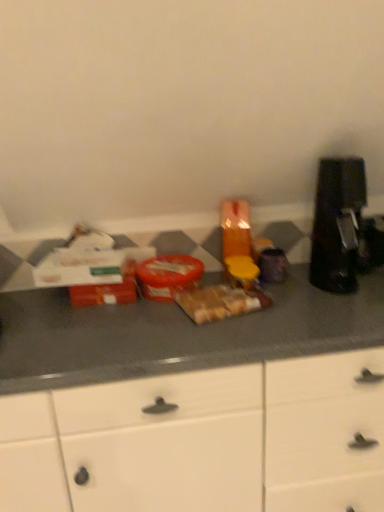
Find the location of a particular element. The height and width of the screenshot is (512, 384). vacant area on top of matte plastic container at center, placed as the 1th food when sorted from left to right (from a real-world perspective) is located at coordinates (161, 261).